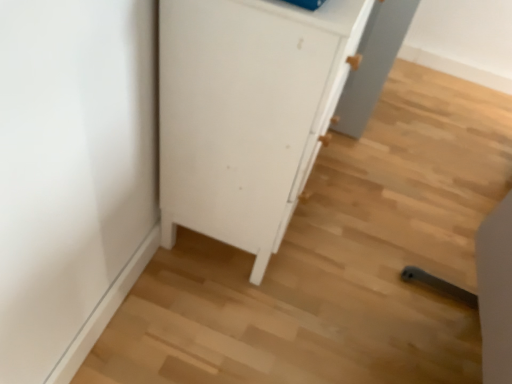
Where is `vacant space that's between light wood chair at lower right and white matte cabinet at center`? The width and height of the screenshot is (512, 384). vacant space that's between light wood chair at lower right and white matte cabinet at center is located at coordinates (338, 263).